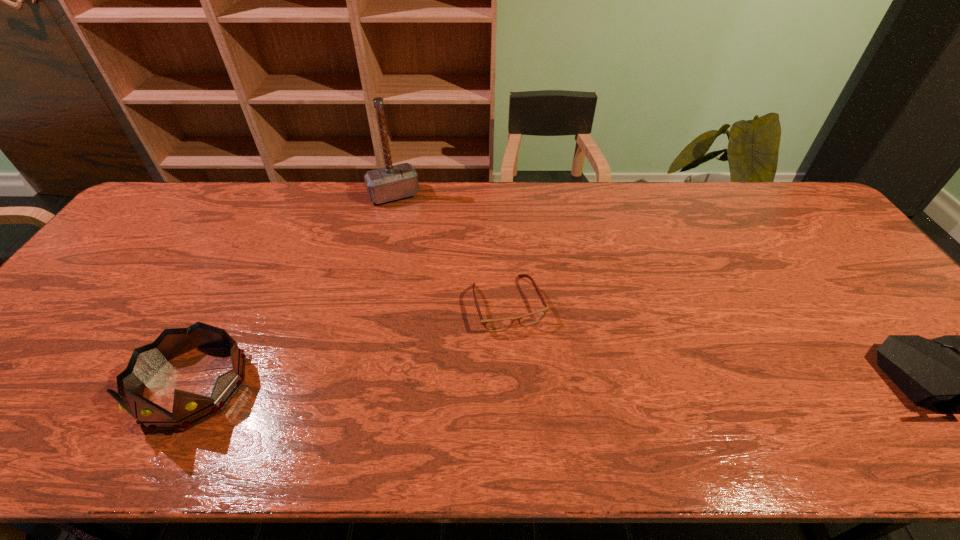
This screenshot has height=540, width=960. Identify the location of free spot on the desktop that is between the third tallest object and the second tallest object and is positioned on the striking surface of the second object from left to right. (485, 383).

This screenshot has height=540, width=960. I want to click on vacant spot on the desktop that is between the leftmost object and the router and is positioned on the front-facing side of the third nearest object, so click(540, 383).